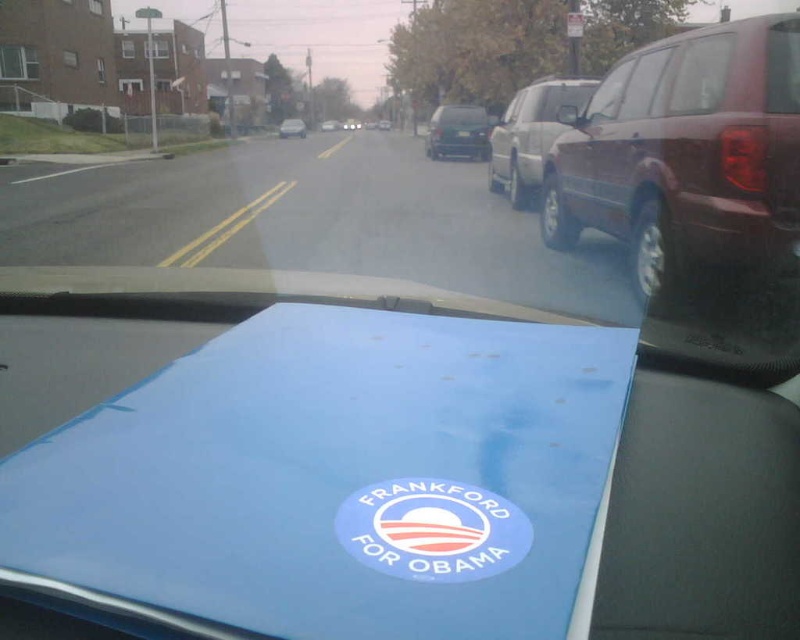
Between point (458, 566) and point (472, 150), which one is positioned in front?

Point (458, 566) is in front.

At what (x,y) coordinates should I click in order to perform the action: click on blue matte sticker at center. Please return your answer as a coordinate pair (x, y). This screenshot has height=640, width=800. Looking at the image, I should click on click(x=432, y=529).

Is point (358, 499) in front of point (462, 115)?

Yes, point (358, 499) is closer to viewer.

Find the location of a particular element. This screenshot has width=800, height=640. blue matte sticker at center is located at coordinates pyautogui.click(x=432, y=529).

Between blue matte sticker at center and satin silver suv at right, which one is positioned lower?

blue matte sticker at center

This screenshot has height=640, width=800. Identify the location of blue matte sticker at center. (432, 529).

Measure the distance between blue matte sticker at center and camera.

blue matte sticker at center is 35.76 inches away from camera.

Locate an element on the screen. Image resolution: width=800 pixels, height=640 pixels. blue matte sticker at center is located at coordinates (432, 529).

Is dark brown matte suv at right shorter than metallic silver sedan at center?

Yes.

Is point (612, 220) more distant than point (284, 120)?

No, it is in front of (284, 120).

Locate an element on the screen. This screenshot has width=800, height=640. dark brown matte suv at right is located at coordinates (686, 156).